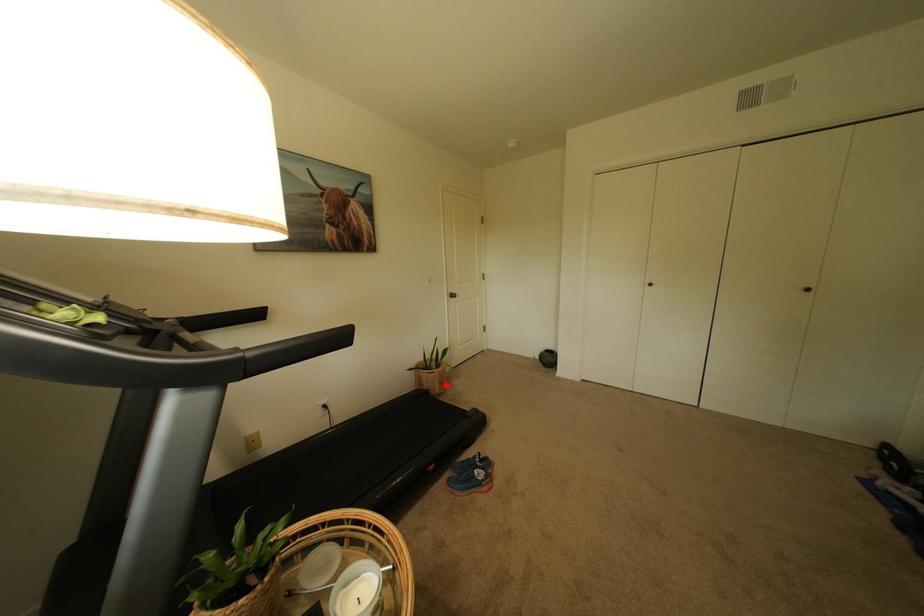
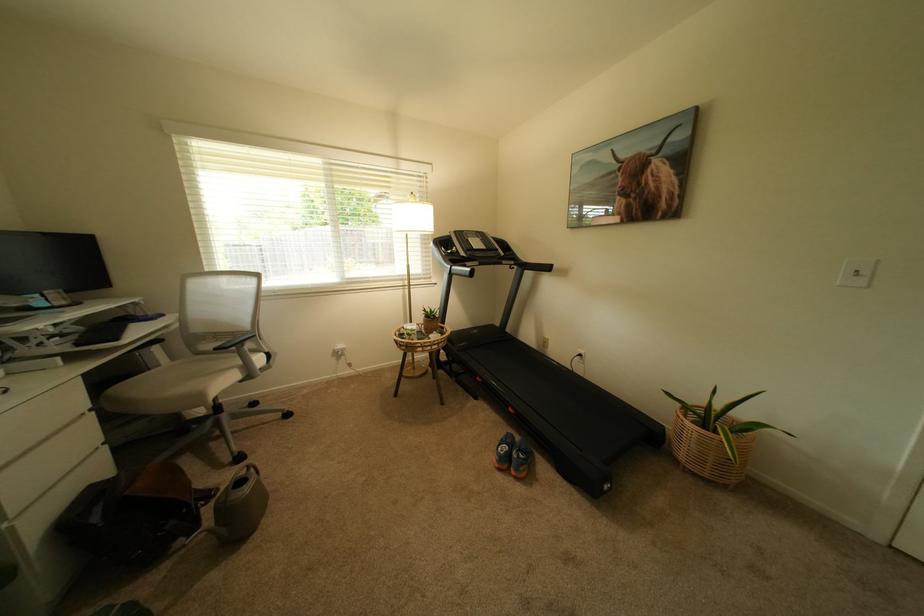
Question: I am providing you with two images of the same scene from different viewpoints. In image1, a red point is highlighted. Considering the same 3D point in image2, which of the following is correct?

Choices:
 (A) It is closer
 (B) It is farther

Answer: (A)